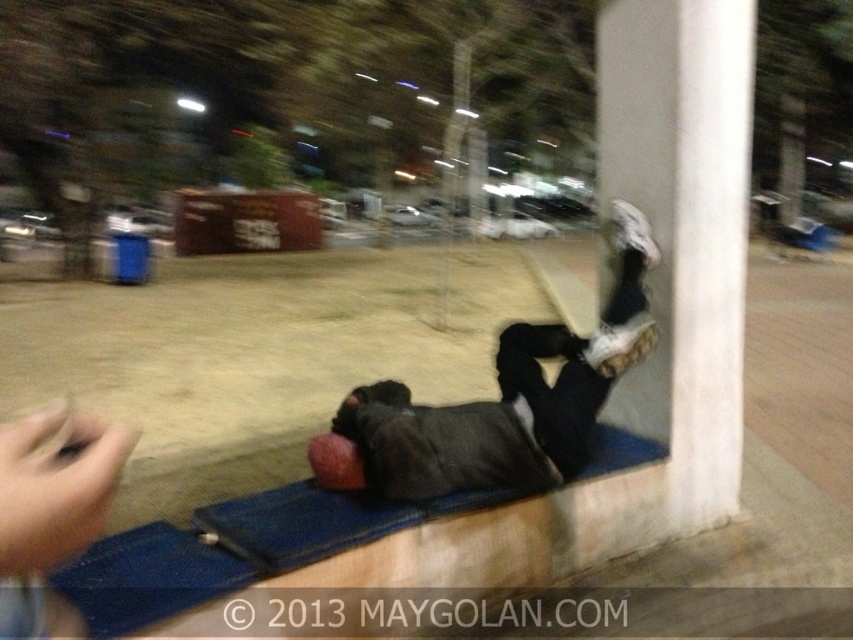
In the scene shown: You are an architect designing a new public space and want to incorporate elements from this scene. If you need to place a bench between the white smooth pillar at upper right and the dark gray fabric at lower right, which object should the bench be closer to to ensure it fits within the space?

The bench should be placed closer to the white smooth pillar at upper right because it has a narrower width compared to the dark gray fabric at lower right, allowing more space for the bench on the wider side.

You are a photographer setting up a shot in the park at night. You want to position a spotlight so that it illuminates both the white smooth pillar at upper right and the dark gray fabric at lower right without overlapping their lit areas. Based on their positions, where should you place the spotlight relative to these two objects?

The white smooth pillar at upper right is to the right of the dark gray fabric at lower right. To illuminate both without overlapping their lit areas, the spotlight should be placed to the left of both objects, directing light towards the right side of the dark gray fabric at lower right and the left side of the white smooth pillar at upper right.

You are a photographer trying to capture a photo of the white smooth pillar at upper right and the dark gray fabric at lower right. Based on their heights, which object should you focus on first to ensure both are in frame?

The white smooth pillar at upper right is taller than the dark gray fabric at lower right, so you should focus on the white smooth pillar at upper right first to ensure both are in frame.